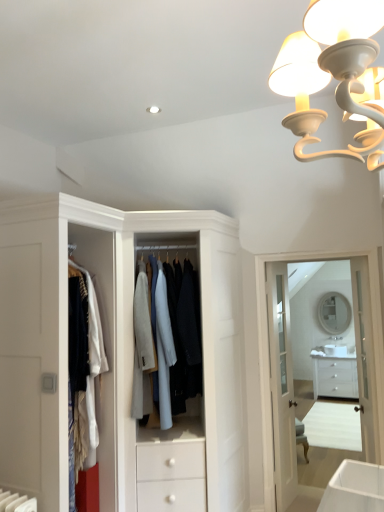
Measure the distance between point (x=287, y=86) and camera.

The depth of point (x=287, y=86) is 1.06 meters.

At what (x,y) coordinates should I click in order to perform the action: click on white matte chandelier at upper right. Please return your answer as a coordinate pair (x, y). This screenshot has width=384, height=512. Looking at the image, I should click on (331, 71).

Image resolution: width=384 pixels, height=512 pixels. What are the coordinates of `white glossy door at center, the 2th door when ordered from right to left` in the screenshot? It's located at (281, 385).

Image resolution: width=384 pixels, height=512 pixels. What do you see at coordinates (365, 357) in the screenshot? I see `white glass door at center, the 1th door from the right` at bounding box center [365, 357].

Identify the location of white matte chandelier at upper right. (331, 71).

From the image's perspective, which is below, white glossy door at center, the 2th door when ordered from right to left, or white glass door at center, the second door when ordered from left to right?

From the image's view, white glossy door at center, the 2th door when ordered from right to left, is below.

From a real-world perspective, which object stands above the other?

In real-world perspective, white glass door at center, the 1th door from the right, is above.

Could you tell me if white glossy door at center, acting as the first door starting from the left, is facing white glass door at center, the 1th door from the right?

Yes, white glossy door at center, acting as the first door starting from the left, is facing white glass door at center, the 1th door from the right.

Between point (280, 364) and point (369, 432), which one is positioned behind?

The point (280, 364) is behind.

Considering the positions of objects white glass door at center, the 1th door from the right, and white glossy medicine cabinet at upper center in the image provided, who is more to the left, white glass door at center, the 1th door from the right, or white glossy medicine cabinet at upper center?

white glossy medicine cabinet at upper center.

Is white glass door at center, the 1th door from the right, looking in the opposite direction of white glossy medicine cabinet at upper center?

Yes, white glossy medicine cabinet at upper center is at the back of white glass door at center, the 1th door from the right.

Is white glass door at center, the second door when ordered from left to right, wider or thinner than white glossy medicine cabinet at upper center?

Considering their sizes, white glass door at center, the second door when ordered from left to right, looks slimmer than white glossy medicine cabinet at upper center.

In terms of size, does white glossy medicine cabinet at upper center appear bigger or smaller than white glass door at center, the second door when ordered from left to right?

Considering their sizes, white glossy medicine cabinet at upper center takes up more space than white glass door at center, the second door when ordered from left to right.

From a real-world perspective, which is physically above, white glossy medicine cabinet at upper center or white glass door at center, the second door when ordered from left to right?

white glass door at center, the second door when ordered from left to right, is physically above.

What are the coordinates of `door on the right of white glossy medicine cabinet at upper center` in the screenshot? It's located at (365, 357).

Would you say white glossy medicine cabinet at upper center is inside or outside light blue fabric coat at center?

white glossy medicine cabinet at upper center cannot be found inside light blue fabric coat at center.

Considering the sizes of white glossy medicine cabinet at upper center and light blue fabric coat at center in the image, is white glossy medicine cabinet at upper center wider or thinner than light blue fabric coat at center?

In the image, white glossy medicine cabinet at upper center appears to be more narrow than light blue fabric coat at center.

From a real-world perspective, is white glossy medicine cabinet at upper center over light blue fabric coat at center?

No.

Measure the distance between white glossy medicine cabinet at upper center and light blue fabric coat at center.

white glossy medicine cabinet at upper center is 87.04 centimeters from light blue fabric coat at center.

Can you confirm if white glossy door at center, the 2th door when ordered from right to left, is shorter than white glossy medicine cabinet at upper center?

Indeed, white glossy door at center, the 2th door when ordered from right to left, has a lesser height compared to white glossy medicine cabinet at upper center.

Which point is more forward, (288, 445) or (264, 261)?

The point (264, 261) is closer.

Which is more to the right, white glossy door at center, the 2th door when ordered from right to left, or white glossy medicine cabinet at upper center?

Positioned to the right is white glossy medicine cabinet at upper center.

From the image's perspective, would you say white glossy door at center, the 2th door when ordered from right to left, is positioned over white glossy medicine cabinet at upper center?

No, from the image's perspective, white glossy door at center, the 2th door when ordered from right to left, is not over white glossy medicine cabinet at upper center.

Is white glass door at center, the second door when ordered from left to right, far away from white matte chandelier at upper right?

white glass door at center, the second door when ordered from left to right, is far away from white matte chandelier at upper right.

Considering the positions of objects white glass door at center, the 1th door from the right, and white matte chandelier at upper right in the image provided, who is in front, white glass door at center, the 1th door from the right, or white matte chandelier at upper right?

Positioned in front is white matte chandelier at upper right.

The height and width of the screenshot is (512, 384). There is a white matte chandelier at upper right. Identify the location of the 1st door below it (from the image's perspective). (365, 357).

Can you tell me how much white glass door at center, the second door when ordered from left to right, and white matte chandelier at upper right differ in facing direction?

The facing directions of white glass door at center, the second door when ordered from left to right, and white matte chandelier at upper right are 9.58 degrees apart.

Does white matte chandelier at upper right lie in front of white glossy chest of drawers at lower right?

Yes.

Considering the sizes of objects white matte chandelier at upper right and white glossy chest of drawers at lower right in the image provided, who is thinner, white matte chandelier at upper right or white glossy chest of drawers at lower right?

white matte chandelier at upper right is thinner.

Can you tell me how much white matte chandelier at upper right and white glossy chest of drawers at lower right differ in facing direction?

The facing directions of white matte chandelier at upper right and white glossy chest of drawers at lower right are 82.9 degrees apart.

Would you say white matte chandelier at upper right is to the left or to the right of white glossy chest of drawers at lower right in the picture?

In the image, white matte chandelier at upper right appears on the left side of white glossy chest of drawers at lower right.

Find the location of a particular element. This screenshot has height=512, width=384. door located in front of the white glossy door at center, the 2th door when ordered from right to left is located at coordinates (365, 357).

The height and width of the screenshot is (512, 384). What are the coordinates of `medicine cabinet that appears below the white glass door at center, the 1th door from the right (from a real-world perspective)` in the screenshot? It's located at (268, 359).

Considering their positions, is white matte chandelier at upper right positioned further to matte white mirror at center than white glossy chest of drawers at lower right?

Among the two, white matte chandelier at upper right is located further to matte white mirror at center.

Estimate the real-world distances between objects in this image. Which object is further from white glossy medicine cabinet at upper center, white matte chandelier at upper right or white glass door at center, the second door when ordered from left to right?

white matte chandelier at upper right lies further to white glossy medicine cabinet at upper center than the other object.

Looking at the image, which one is located closer to light blue fabric coat at center, white glass door at center, the 1th door from the right, or white glossy medicine cabinet at upper center?

Among the two, white glossy medicine cabinet at upper center is located nearer to light blue fabric coat at center.

Based on their spatial positions, is white glossy door at center, the 2th door when ordered from right to left, or white glossy medicine cabinet at upper center further from white matte chandelier at upper right?

white glossy door at center, the 2th door when ordered from right to left.

From the image, which object appears to be farther from matte white mirror at center, light blue fabric coat at center or white glossy chest of drawers at lower right?

Among the two, light blue fabric coat at center is located further to matte white mirror at center.

Based on their spatial positions, is white glossy medicine cabinet at upper center or light blue fabric coat at center further from matte white mirror at center?

light blue fabric coat at center is positioned further to the anchor matte white mirror at center.

When comparing their distances from white glass door at center, the 1th door from the right, does matte white mirror at center or light blue fabric coat at center seem closer?

The object closer to white glass door at center, the 1th door from the right, is matte white mirror at center.

From the image, which object appears to be nearer to white glossy door at center, acting as the first door starting from the left, white glossy chest of drawers at lower right or light blue fabric coat at center?

The object closer to white glossy door at center, acting as the first door starting from the left, is white glossy chest of drawers at lower right.

At what (x,y) coordinates should I click in order to perform the action: click on door between white glass door at center, the 1th door from the right, and white glossy chest of drawers at lower right from front to back. Please return your answer as a coordinate pair (x, y). Looking at the image, I should click on (281, 385).

Locate an element on the screen. This screenshot has width=384, height=512. door between white matte chandelier at upper right and white glossy door at center, the 2th door when ordered from right to left, in the front-back direction is located at coordinates (365, 357).

Locate an element on the screen. The height and width of the screenshot is (512, 384). medicine cabinet between white matte chandelier at upper right and matte white mirror at center from front to back is located at coordinates (268, 359).

What are the coordinates of `clothing between white matte chandelier at upper right and white glossy medicine cabinet at upper center along the z-axis` in the screenshot? It's located at (175, 337).